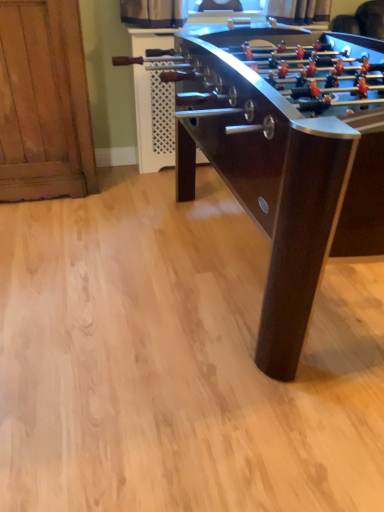
Image resolution: width=384 pixels, height=512 pixels. In order to click on free point below dark brown wood foosball table at center (from a real-world perspective) in this screenshot , I will do `click(239, 271)`.